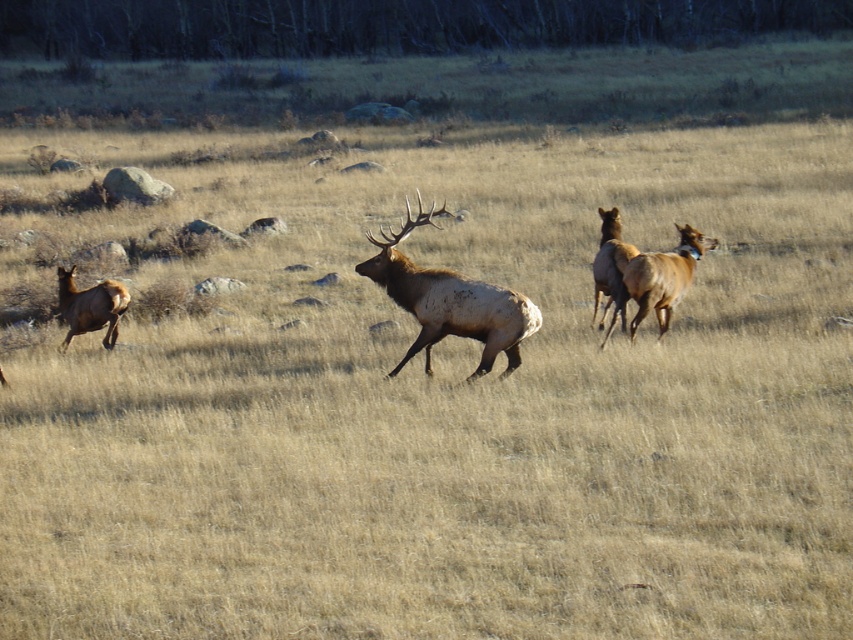
How distant is brown velvet deer at center from brown velvet deer at right?

brown velvet deer at center is 4.39 feet from brown velvet deer at right.

Is point (407, 289) positioned after point (695, 243)?

No, (407, 289) is closer to viewer.

Find the location of `brown velvet deer at center`. brown velvet deer at center is located at coordinates (450, 301).

Can you confirm if brown velvet deer at left is bigger than brown velvet antlered deer at center?

No, brown velvet deer at left is not bigger than brown velvet antlered deer at center.

Who is taller, brown velvet deer at left or brown velvet antlered deer at center?

brown velvet antlered deer at center is taller.

The height and width of the screenshot is (640, 853). What do you see at coordinates (90, 307) in the screenshot? I see `brown velvet deer at left` at bounding box center [90, 307].

At what (x,y) coordinates should I click in order to perform the action: click on brown velvet deer at left. Please return your answer as a coordinate pair (x, y). Looking at the image, I should click on (90, 307).

Is brown velvet deer at center thinner than brown velvet antlered deer at center?

In fact, brown velvet deer at center might be wider than brown velvet antlered deer at center.

Which is below, brown velvet deer at center or brown velvet antlered deer at center?

brown velvet deer at center

You are a GUI agent. You are given a task and a screenshot of the screen. Output one action in this format:
    pyautogui.click(x=<x>, y=<y>)
    Task: Click on the brown velvet deer at center
    The height and width of the screenshot is (640, 853).
    Given the screenshot: What is the action you would take?
    pyautogui.click(x=450, y=301)